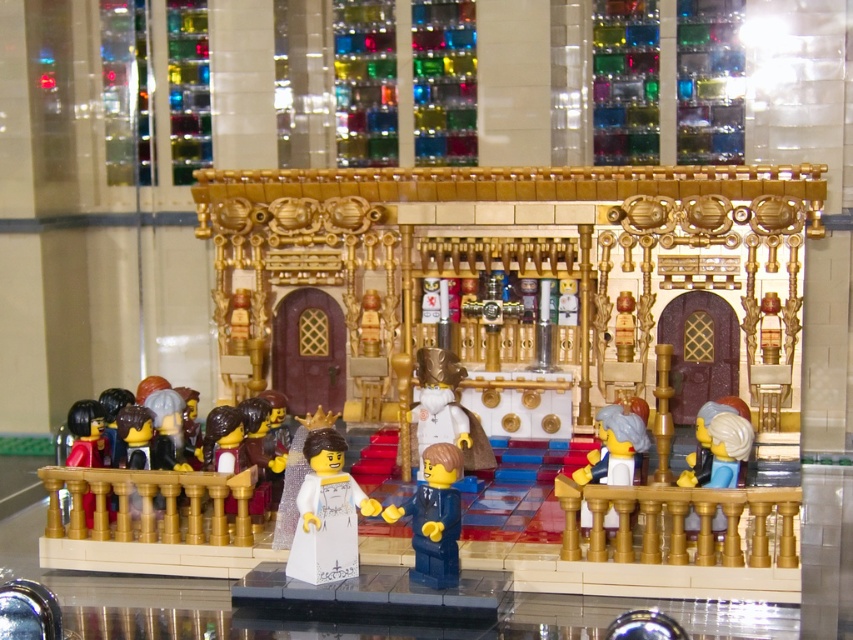
Which is in front, point (303, 557) or point (457, 509)?

Point (303, 557) is in front.

In order to click on white glossy minifigure at center in this screenshot , I will do `click(328, 513)`.

Locate an element on the screen. white glossy minifigure at center is located at coordinates (328, 513).

Image resolution: width=853 pixels, height=640 pixels. I want to click on white glossy minifigure at center, so click(x=328, y=513).

Between white matte minifigure at right and matte black minifigure at lower left, which one has more height?

Standing taller between the two is matte black minifigure at lower left.

Does white matte minifigure at right come behind matte black minifigure at lower left?

That is False.

Measure the distance between point (627,417) and camera.

4.57 meters

The height and width of the screenshot is (640, 853). In order to click on white matte minifigure at right in this screenshot , I will do `click(614, 449)`.

Who is taller, white glossy minifigure at center or white matte minifigure at right?

white glossy minifigure at center

Can you confirm if white glossy minifigure at center is shorter than white matte minifigure at right?

Incorrect, white glossy minifigure at center's height does not fall short of white matte minifigure at right's.

Locate an element on the screen. The width and height of the screenshot is (853, 640). white glossy minifigure at center is located at coordinates [x=328, y=513].

I want to click on white glossy minifigure at center, so click(x=328, y=513).